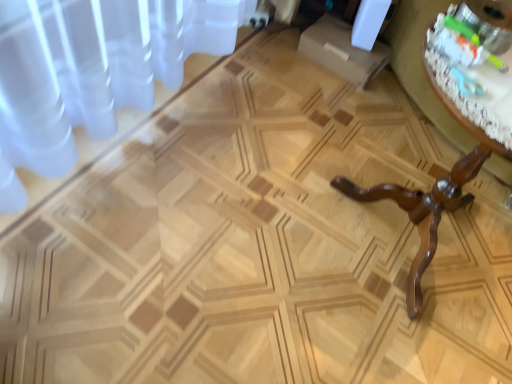
Question: Is translucent glass bowl at upper right not close to wooden table at right?

Choices:
 (A) no
 (B) yes

Answer: (A)

Question: From the image's perspective, is translucent glass bowl at upper right located above wooden table at right?

Choices:
 (A) yes
 (B) no

Answer: (A)

Question: Is the depth of translucent glass bowl at upper right greater than that of wooden table at right?

Choices:
 (A) yes
 (B) no

Answer: (A)

Question: Is translucent glass bowl at upper right outside of wooden table at right?

Choices:
 (A) yes
 (B) no

Answer: (B)

Question: Is translucent glass bowl at upper right positioned with its back to wooden table at right?

Choices:
 (A) no
 (B) yes

Answer: (A)

Question: From a real-world perspective, is translucent glass bowl at upper right physically above wooden table at right?

Choices:
 (A) yes
 (B) no

Answer: (A)

Question: Can you confirm if wooden table at right is wider than translucent glass bowl at upper right?

Choices:
 (A) no
 (B) yes

Answer: (B)

Question: From a real-world perspective, is wooden table at right positioned under translucent glass bowl at upper right based on gravity?

Choices:
 (A) yes
 (B) no

Answer: (A)

Question: Is wooden table at right beside translucent glass bowl at upper right?

Choices:
 (A) no
 (B) yes

Answer: (A)

Question: Considering the relative positions of wooden table at right and translucent glass bowl at upper right in the image provided, is wooden table at right behind translucent glass bowl at upper right?

Choices:
 (A) no
 (B) yes

Answer: (A)

Question: Would you consider wooden table at right to be distant from translucent glass bowl at upper right?

Choices:
 (A) yes
 (B) no

Answer: (B)

Question: Can you confirm if wooden table at right is thinner than translucent glass bowl at upper right?

Choices:
 (A) yes
 (B) no

Answer: (B)

Question: Is translucent glass bowl at upper right wider or thinner than wooden table at right?

Choices:
 (A) thin
 (B) wide

Answer: (A)